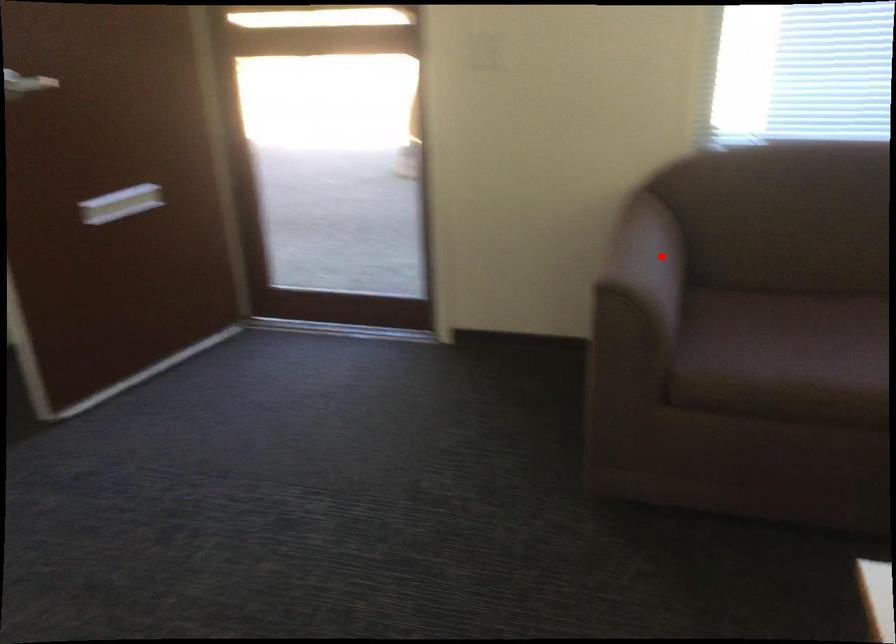
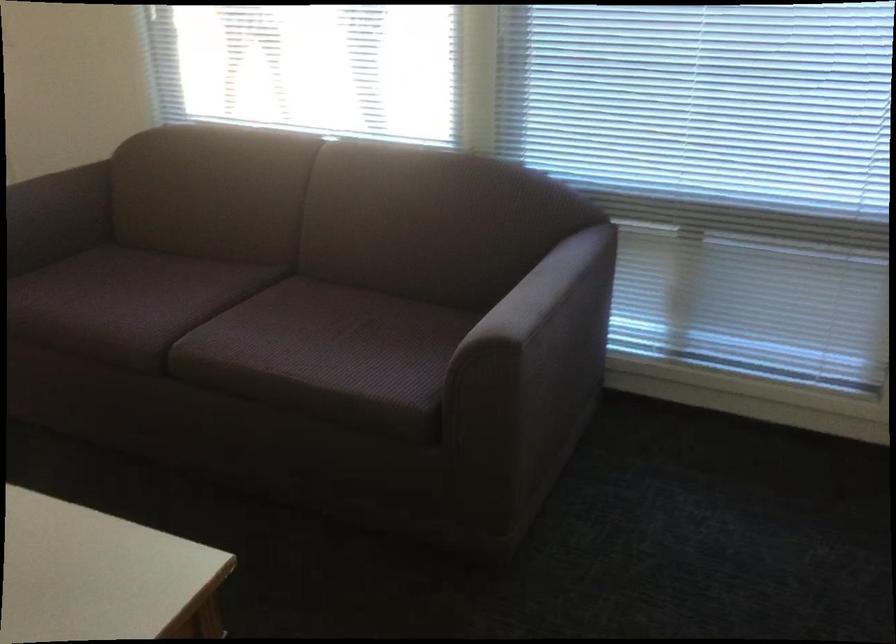
Question: I am providing you with two images of the same scene from different viewpoints. In image1, a red point is highlighted. Considering the same 3D point in image2, which of the following is correct?

Choices:
 (A) It is closer
 (B) It is farther

Answer: (B)